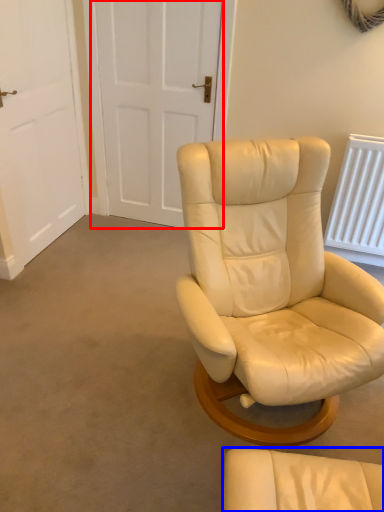
Question: Which point is closer to the camera, door (highlighted by a red box) or chair (highlighted by a blue box)?

Choices:
 (A) door
 (B) chair

Answer: (B)